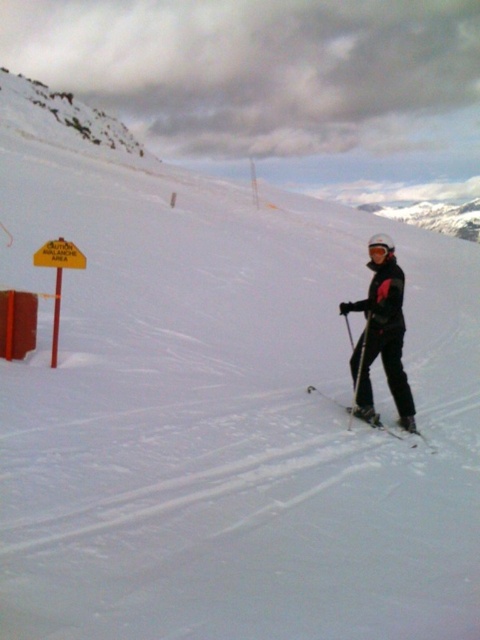
Question: In this image, where is black matte ski suit at center located relative to matte black ski at center?

Choices:
 (A) right
 (B) left

Answer: (B)

Question: Can you confirm if black matte ski suit at center is positioned to the left of matte black ski at center?

Choices:
 (A) yes
 (B) no

Answer: (A)

Question: Which point is closer to the camera?

Choices:
 (A) (388, 428)
 (B) (387, 355)
 (C) (374, 241)

Answer: (C)

Question: Estimate the real-world distances between objects in this image. Which object is closer to the black plastic ski pole at right?

Choices:
 (A) matte black ski at center
 (B) black matte ski suit at center

Answer: (A)

Question: Which object is the farthest from the white matte goggles at center?

Choices:
 (A) matte black ski at center
 (B) black plastic ski pole at right
 (C) black matte ski suit at center

Answer: (B)

Question: Is matte black ski at center bigger than black plastic ski pole at right?

Choices:
 (A) yes
 (B) no

Answer: (B)